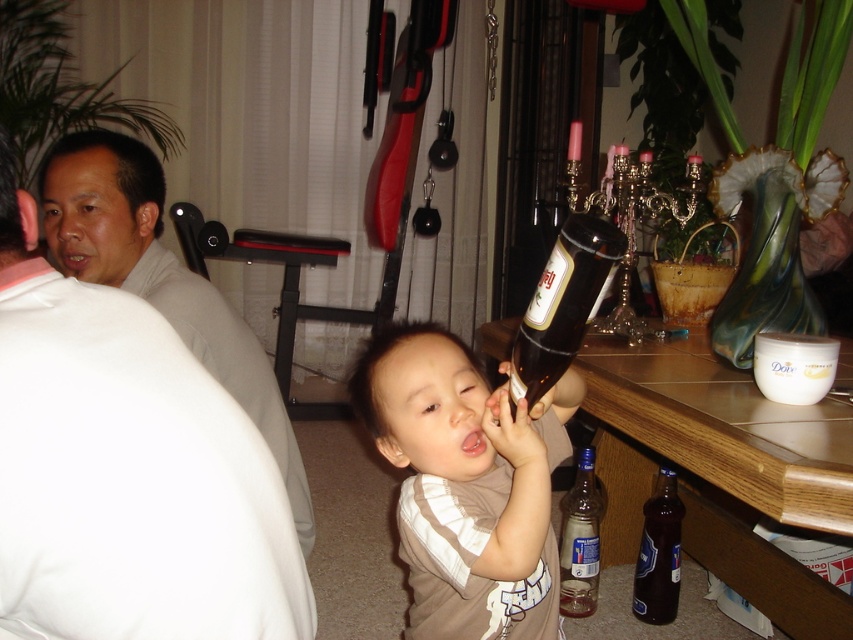
Is brown striped shirt at center wider than matte white shirt at left?

Incorrect, brown striped shirt at center's width does not surpass matte white shirt at left's.

Between brown striped shirt at center and matte white shirt at left, which one has less height?

brown striped shirt at center is shorter.

Between point (503, 428) and point (148, 156), which one is positioned behind?

The point (148, 156) is behind.

The image size is (853, 640). What are the coordinates of `brown striped shirt at center` in the screenshot? It's located at (465, 484).

Is matte white shirt at left taller than clear glass bottle at lower center?

Indeed, matte white shirt at left has a greater height compared to clear glass bottle at lower center.

Is matte white shirt at left thinner than clear glass bottle at lower center?

No, matte white shirt at left is not thinner than clear glass bottle at lower center.

Who is more distant from viewer, (67, 164) or (573, 605)?

Point (573, 605)

The image size is (853, 640). I want to click on matte white shirt at left, so click(160, 280).

Is brown striped shirt at center positioned behind brown glass bottle at center?

Yes, it is.

The height and width of the screenshot is (640, 853). I want to click on brown striped shirt at center, so click(465, 484).